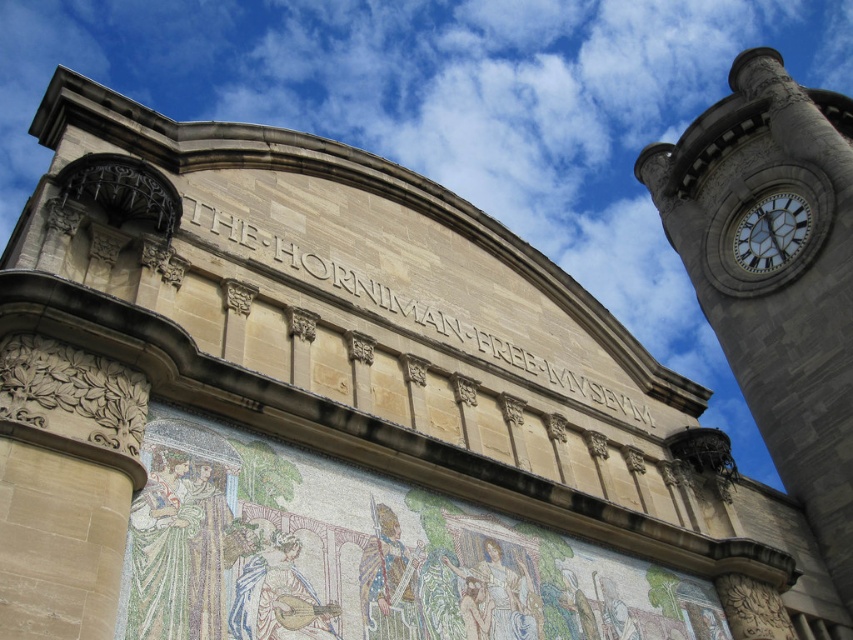
Question: Does stone clock tower at upper right appear over white glossy clock at upper right?

Choices:
 (A) yes
 (B) no

Answer: (B)

Question: Which point is farther from the camera taking this photo?

Choices:
 (A) (808, 209)
 (B) (572, 573)
 (C) (666, 220)

Answer: (C)

Question: Does mosaic artwork at center have a lesser width compared to white glossy clock at upper right?

Choices:
 (A) yes
 (B) no

Answer: (B)

Question: Among these objects, which one is nearest to the camera?

Choices:
 (A) stone clock tower at upper right
 (B) mosaic artwork at center

Answer: (B)

Question: Is mosaic artwork at center wider than white glossy clock at upper right?

Choices:
 (A) yes
 (B) no

Answer: (A)

Question: Which point appears closest to the camera in this image?

Choices:
 (A) (758, 237)
 (B) (326, 540)

Answer: (B)